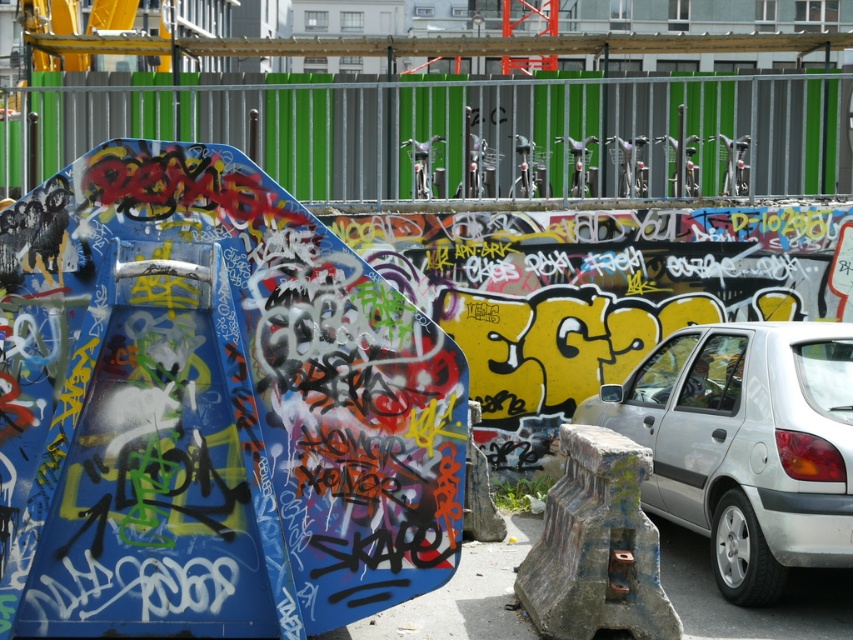
You are a photographer standing in front of the skate ramp. You want to take a photo of the silver metallic car at right without including the metallic silver fence at upper center in the frame. Is this possible based on their positions?

The metallic silver fence at upper center is positioned over the silver metallic car at right, so it would block the view of the car. Therefore, it is not possible to take a photo of the silver metallic car at right without including the metallic silver fence at upper center in the frame.

You are a painter planning to add a new mural on the wall behind the metallic silver fence at upper center and the silver metallic car at right. Which object will require less paint to cover its surface area?

The metallic silver fence at upper center requires less paint to cover its surface area because it is thinner than the silver metallic car at right.